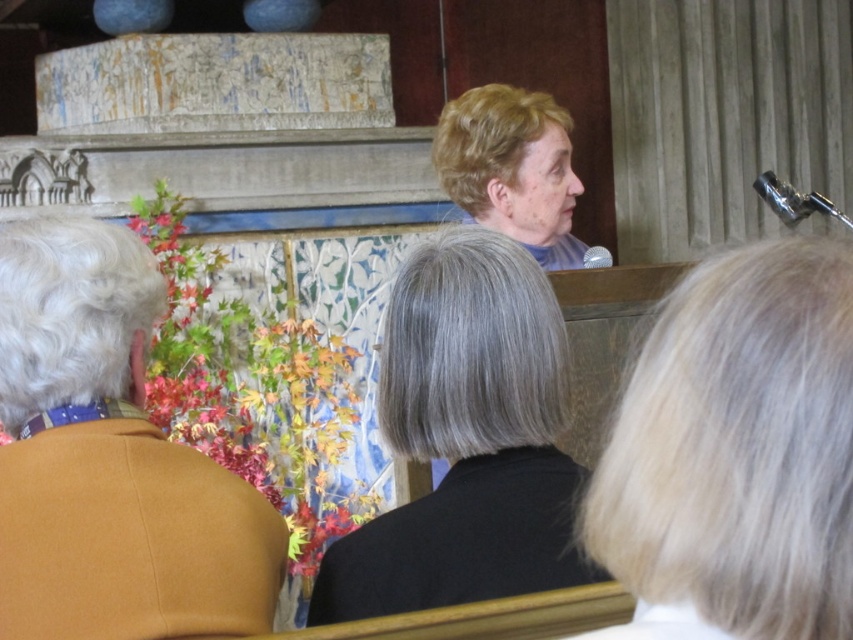
Question: Is blonde hair at upper right positioned at the back of orange wool sweater at left?

Choices:
 (A) no
 (B) yes

Answer: (A)

Question: Which object is farther from the camera taking this photo?

Choices:
 (A) gray matte hair at center
 (B) blonde hair at upper right
 (C) light brown hair at upper center
 (D) orange wool sweater at left

Answer: (C)

Question: Can you confirm if blonde hair at upper right is thinner than light brown hair at upper center?

Choices:
 (A) yes
 (B) no

Answer: (A)

Question: Which point is closer to the camera?

Choices:
 (A) blonde hair at upper right
 (B) orange wool sweater at left
 (C) gray matte hair at center
 (D) light brown hair at upper center

Answer: (A)

Question: Can you confirm if blonde hair at upper right is positioned below orange wool sweater at left?

Choices:
 (A) no
 (B) yes

Answer: (A)

Question: Considering the real-world distances, which object is closest to the gray matte hair at center?

Choices:
 (A) light brown hair at upper center
 (B) blonde hair at upper right

Answer: (B)